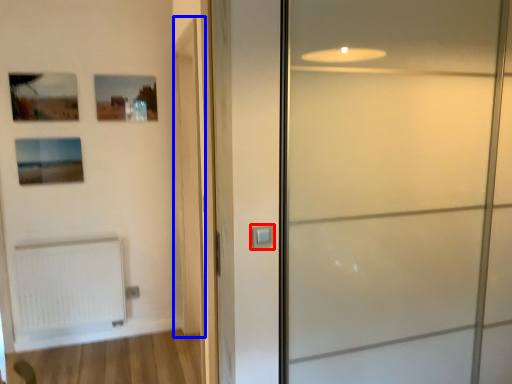
Question: Which object is further to the camera taking this photo, door handle (highlighted by a red box) or barn door (highlighted by a blue box)?

Choices:
 (A) door handle
 (B) barn door

Answer: (B)